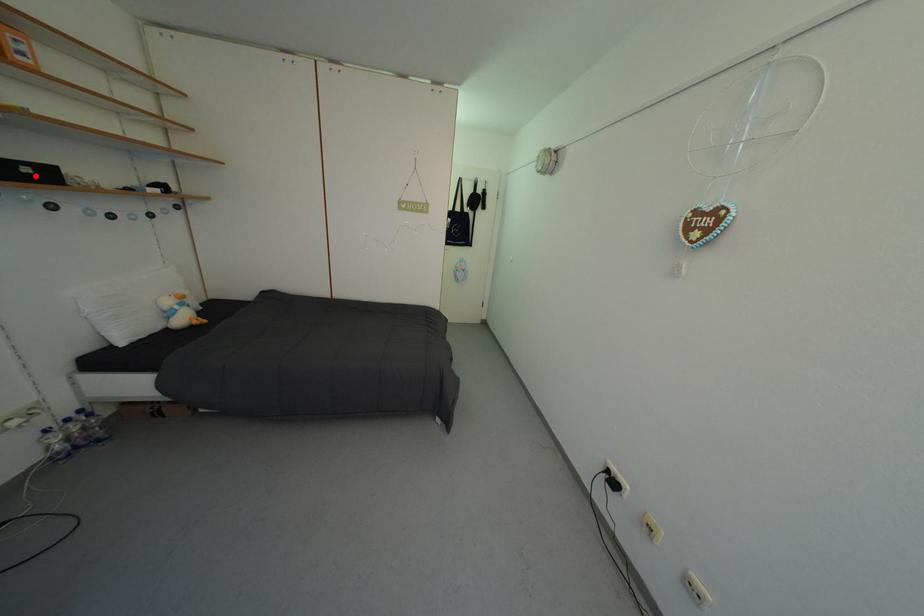
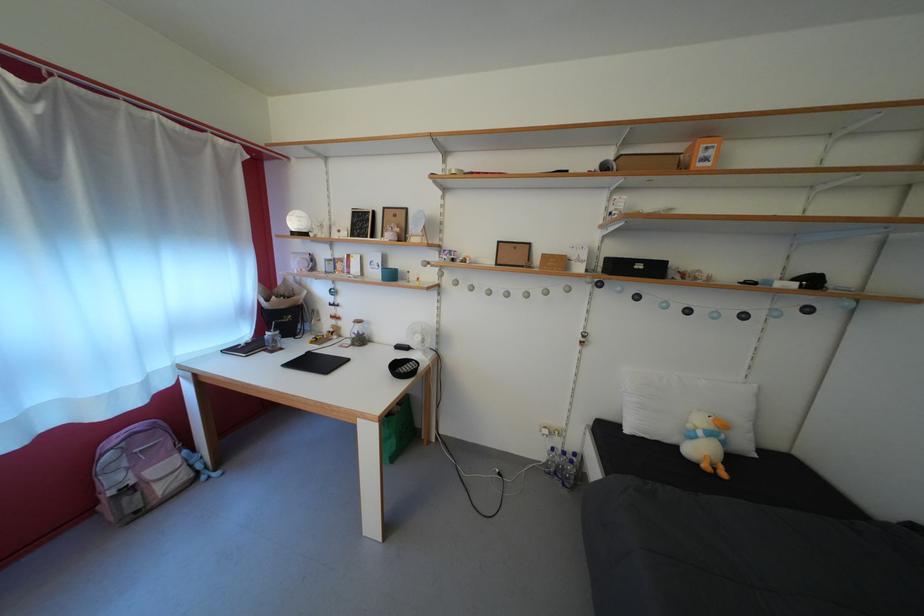
Question: I am providing you with two images of the same scene from different viewpoints. A red point is shown in image1. For the corresponding object point in image2, is it positioned nearer or farther from the camera?

Choices:
 (A) Nearer
 (B) Farther

Answer: (A)